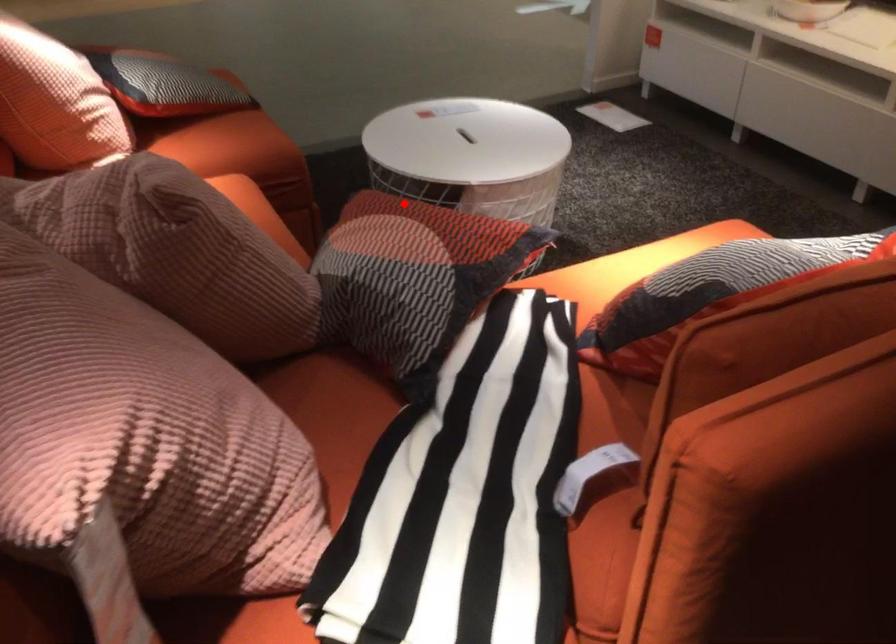
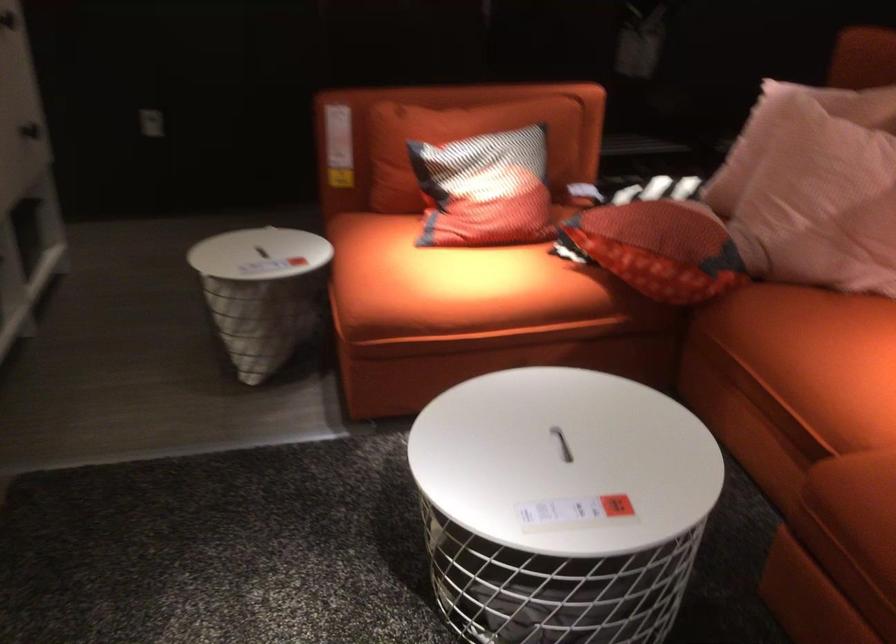
Locate, in the second image, the point that corresponds to the highlighted location in the first image.

(659, 248)